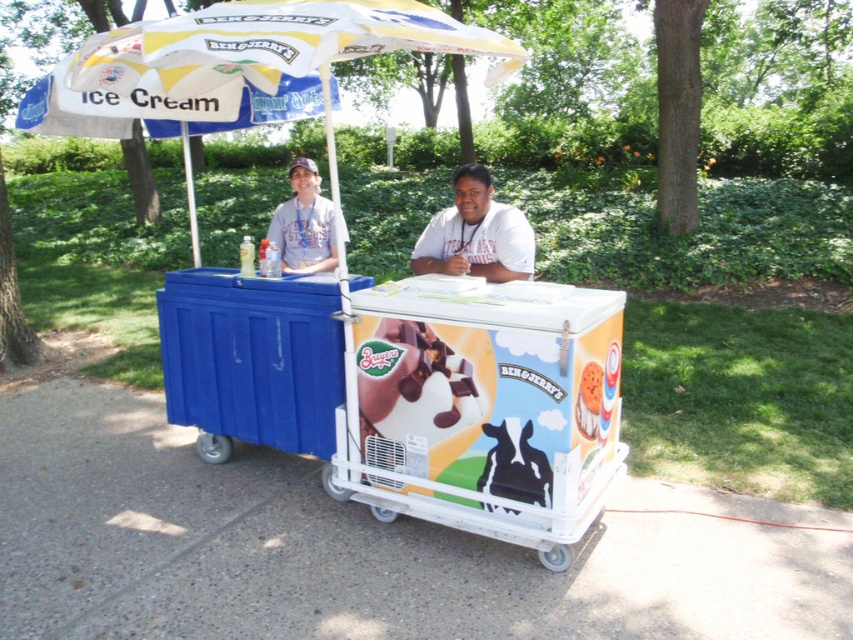
You are a customer standing at the Ben and Jerry s ice cream cart and you want to reach the white fabric umbrella at upper left and the white matte shirt at center. Which object is closer to you?

Both the white fabric umbrella at upper left and the white matte shirt at center are 5.90 feet apart from each other, so neither is closer than the other.

You are a customer at the Ben and Jerry ice cream cart. You want to find the blue plastic cooler at center. Where should you look?

You should look at point (251, 358) to find the blue plastic cooler at center.

You are a customer at the Ben and Jerry ice cream cart. You want to place your phone on a surface that is wider than the white fabric umbrella at upper left. Can you put your phone on the blue plastic cooler at center?

The blue plastic cooler at center might be wider than the white fabric umbrella at upper left, so it is possible that the cooler can accommodate the phone. However, since the width comparison is uncertain, there is a chance it may not fit perfectly.